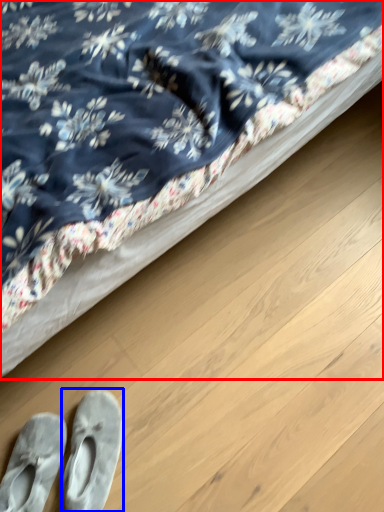
Question: Which object appears closest to the camera in this image, bed (highlighted by a red box) or footwear (highlighted by a blue box)?

Choices:
 (A) bed
 (B) footwear

Answer: (A)